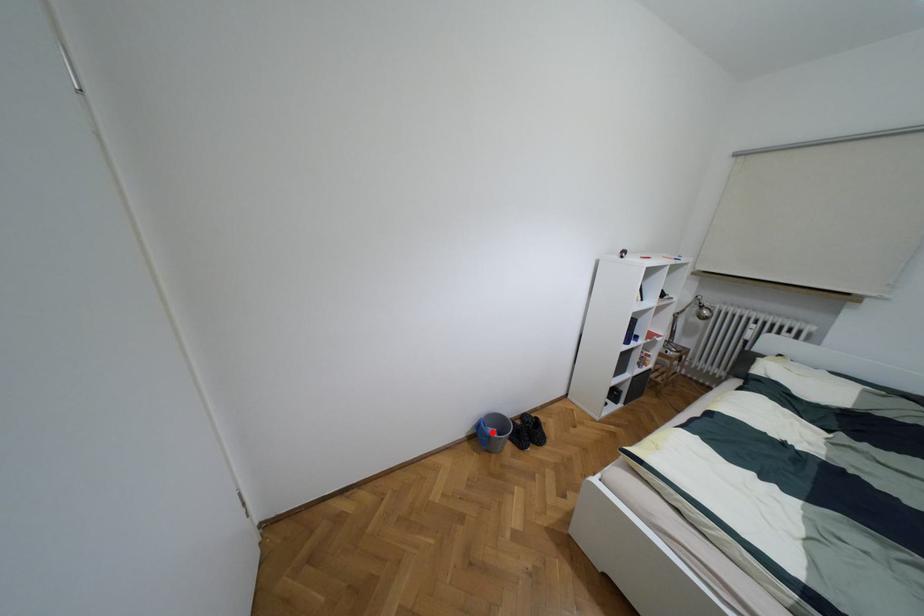
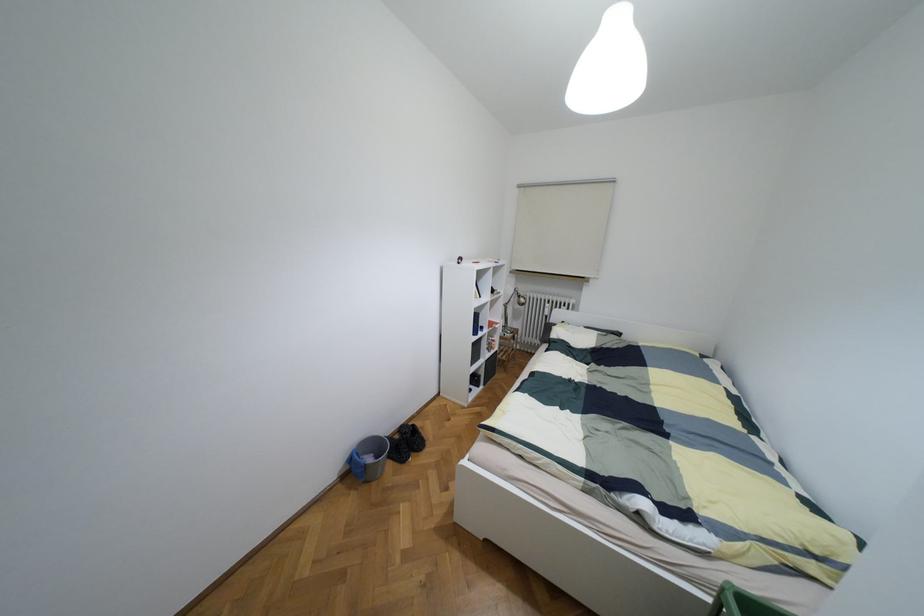
Question: A red point is marked in image1. In image2, is the corresponding 3D point closer to the camera or farther? Reply with the corresponding letter.

Choices:
 (A) The corresponding 3D point is closer.
 (B) The corresponding 3D point is farther.

Answer: (A)